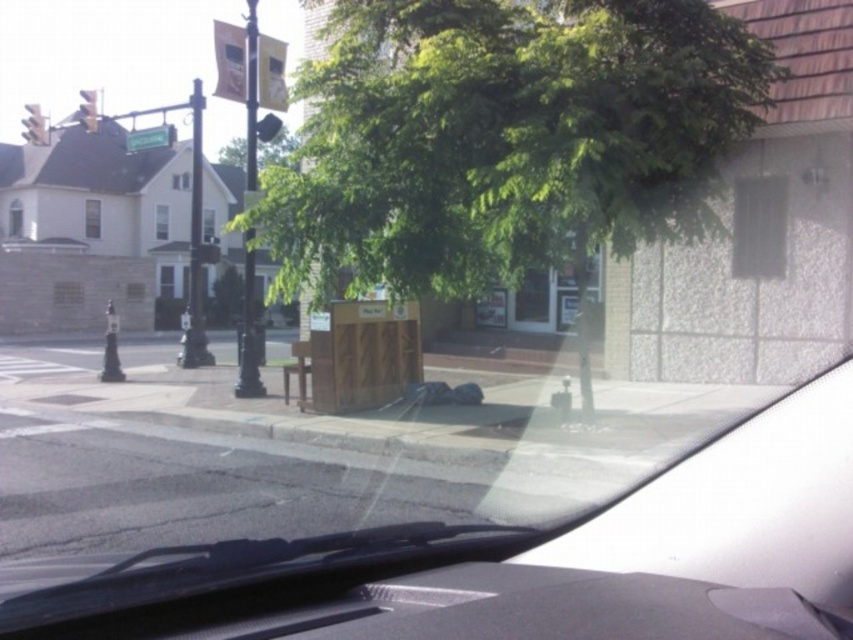
You are sitting in the driver seat of the vehicle shown in the image. You need to check if there is an obstacle blocking your view of the street ahead. Based on the location of the green leafy tree at center, can you determine if it might be obstructing your view?

The green leafy tree at center is located at point [508,138], which is near the center of the image. Since the image is taken from the driver seat, the tree is likely positioned in front of the vehicle, potentially blocking part of the view of the street ahead.

You are a passenger in the vehicle and notice two objects outside the window. Based on your current view from the vehicle, which object is closer to you between the green leafy tree at center and the white matte car at center?

The green leafy tree at center is closer to you because the white matte car at center is positioned behind it.